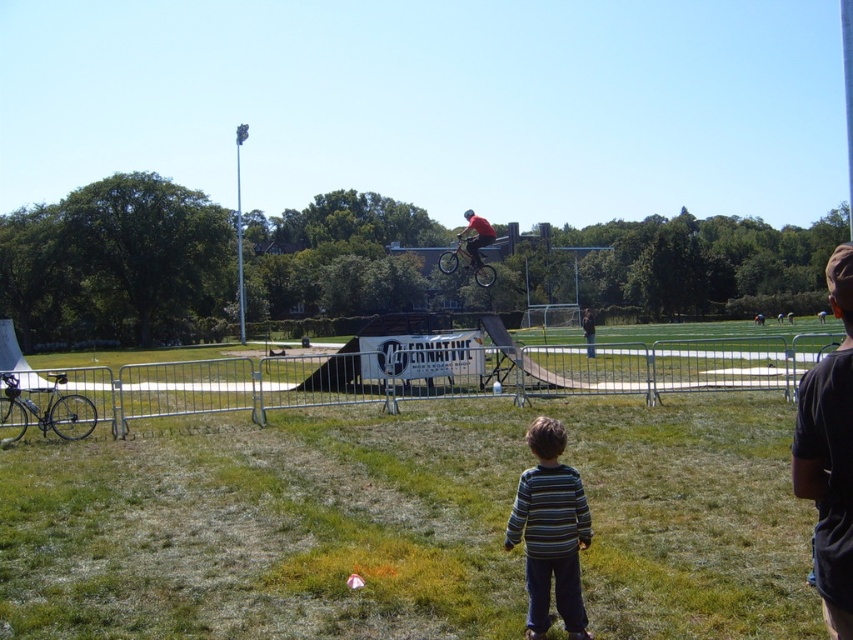
Can you confirm if black cotton shirt at right is wider than shiny silver bicycle at lower left?

Yes, black cotton shirt at right is wider than shiny silver bicycle at lower left.

Is black cotton shirt at right to the left of shiny silver bicycle at lower left from the viewer's perspective?

Incorrect, black cotton shirt at right is not on the left side of shiny silver bicycle at lower left.

Which is behind, point (811, 388) or point (56, 408)?

Positioned behind is point (56, 408).

This screenshot has height=640, width=853. What are the coordinates of `black cotton shirt at right` in the screenshot? It's located at (828, 454).

Is point (517, 525) behind point (3, 419)?

No, it is not.

Is striped sweater at center shorter than shiny silver bicycle at lower left?

In fact, striped sweater at center may be taller than shiny silver bicycle at lower left.

Measure the distance between striped sweater at center and camera.

striped sweater at center and camera are 4.78 meters apart.

I want to click on striped sweater at center, so click(x=550, y=531).

Can you confirm if striped sweater at center is smaller than red matte bicycle at center?

Yes.

Can you confirm if striped sweater at center is wider than red matte bicycle at center?

No, striped sweater at center is not wider than red matte bicycle at center.

The width and height of the screenshot is (853, 640). I want to click on striped sweater at center, so click(x=550, y=531).